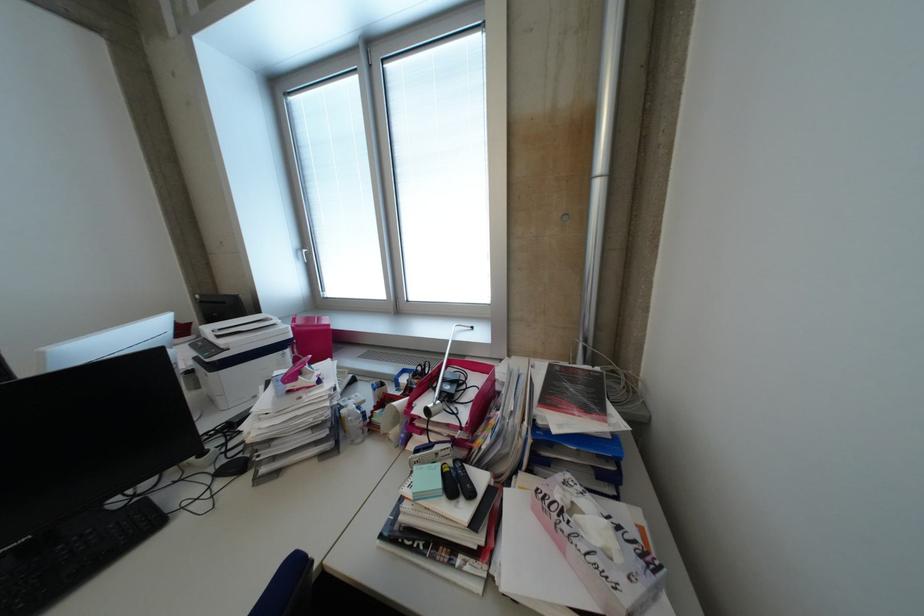
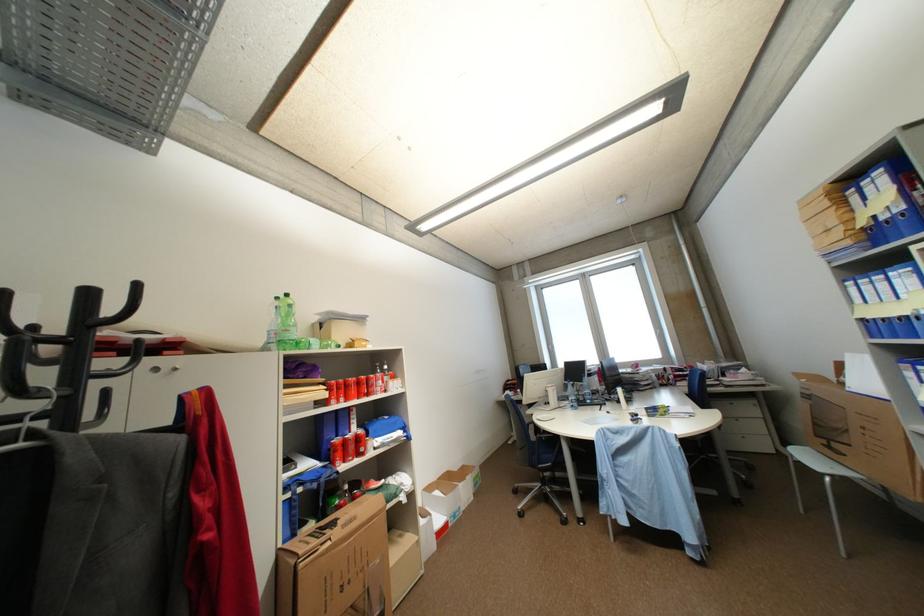
In a continuous first-person perspective shot, in which direction is the camera moving?

The movement direction of the cameraman is left, backward.